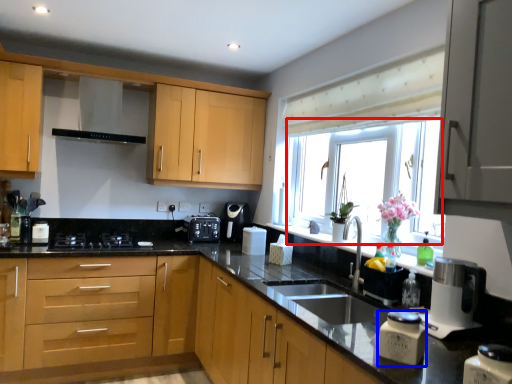
Question: Among these objects, which one is farthest to the camera, window screen (highlighted by a red box) or kitchen appliance (highlighted by a blue box)?

Choices:
 (A) window screen
 (B) kitchen appliance

Answer: (A)